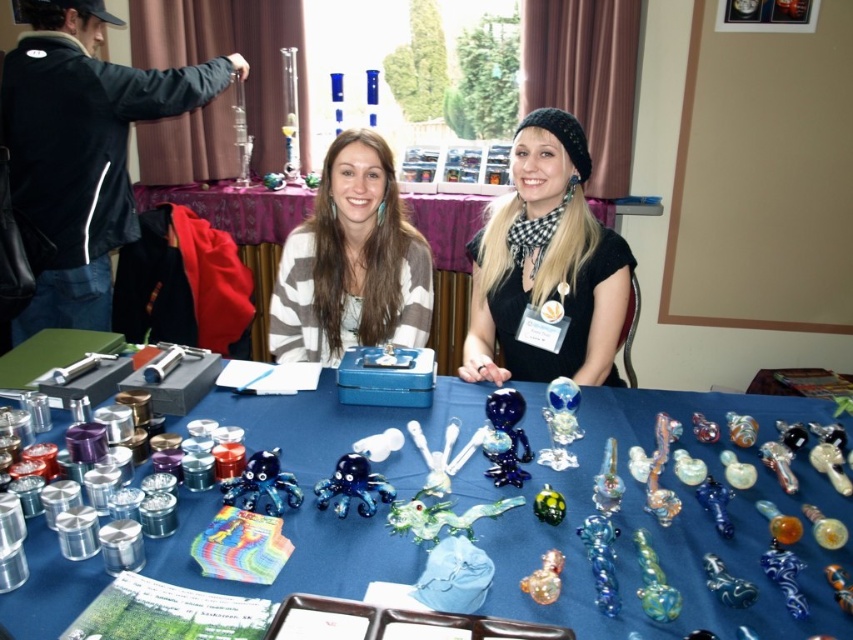
You are a photographer at the craft fair and want to take a photo of the two people. To ensure both the black matte scarf at upper center and the white striped sweater at center are visible, which direction should you position the camera relative to the subjects?

The black matte scarf at upper center is to the right of the white striped sweater at center, so positioning the camera to the left side of the subjects will ensure both items are visible in the frame.

You are standing in front of the table at the glass art exhibition. There are two points marked on the table surface. The first point is at coordinate point (573, 272) and the second point is at coordinate point (444, 221). Which point is closer to you?

Point (573, 272) is closer to the viewer than point (444, 221).

You are a customer at the craft fair and want to buy a scarf and a sweater. The vendor has a limited stock. You notice the black matte scarf at upper center and the white striped sweater at center. Can you tell which item is bigger?

The black matte scarf at upper center is larger in size than the white striped sweater at center.